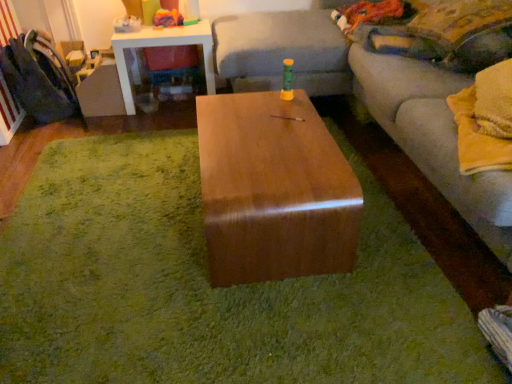
The image size is (512, 384). In order to click on free spot above shiny brown wood coffee table at center (from a real-world perspective) in this screenshot , I will do `click(271, 140)`.